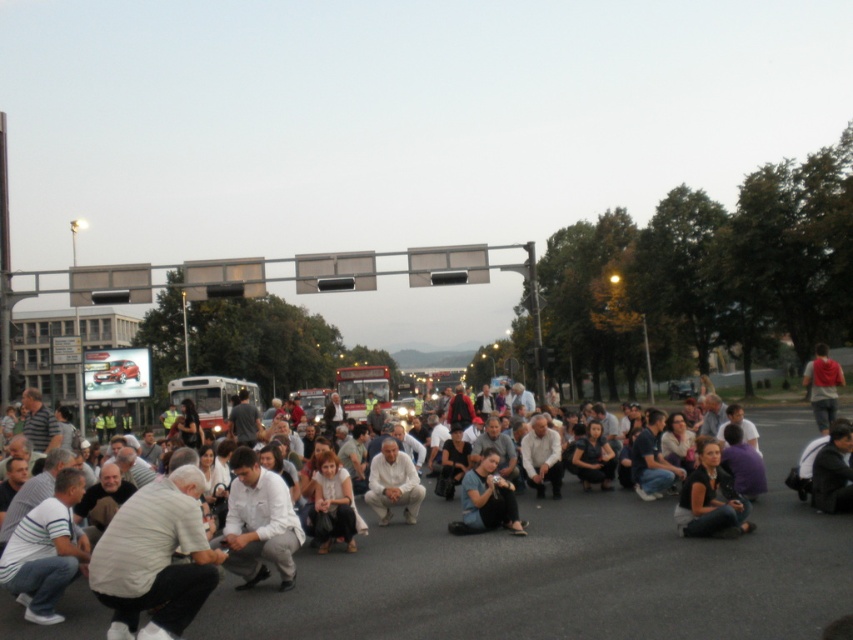
Question: Among these points, which one is farthest from the camera?

Choices:
 (A) (718, 474)
 (B) (22, 572)
 (C) (827, 364)
 (D) (490, 461)

Answer: (C)

Question: Is white striped shirt at lower left bigger than white matte shirt at center?

Choices:
 (A) yes
 (B) no

Answer: (B)

Question: Considering the real-world distances, which object is farthest from the white matte shirt at center?

Choices:
 (A) white cotton shirt at lower left
 (B) white striped shirt at lower left

Answer: (A)

Question: Does white cotton shirt at center appear over blue cotton shirt at center?

Choices:
 (A) no
 (B) yes

Answer: (A)

Question: Considering the relative positions of white matte shirt at center and light beige fabric pants at center in the image provided, where is white matte shirt at center located with respect to light beige fabric pants at center?

Choices:
 (A) right
 (B) left

Answer: (B)

Question: Estimate the real-world distances between objects in this image. Which object is farther from the white striped shirt at lower left?

Choices:
 (A) white cotton shirt at center
 (B) white cotton shirt at lower left
 (C) red backpack at right

Answer: (C)